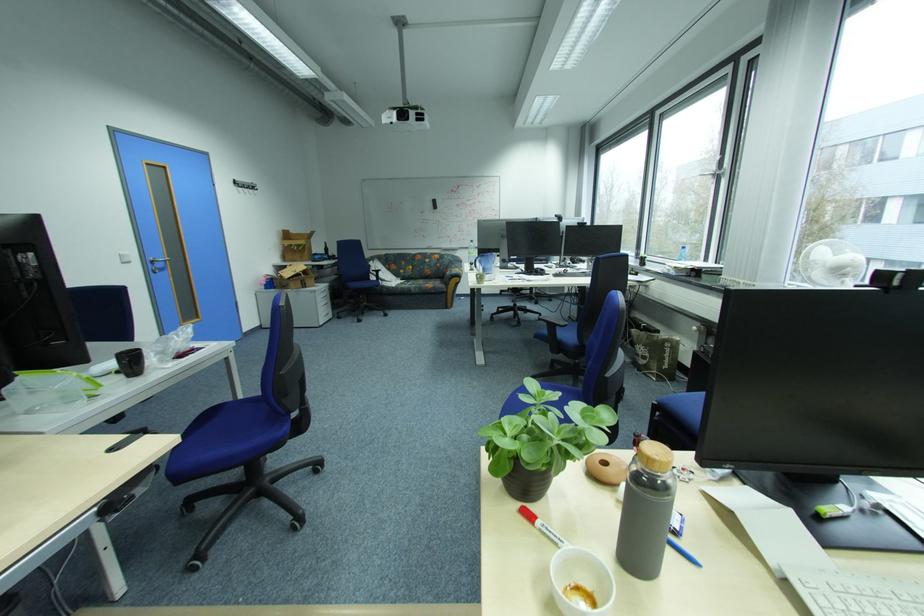
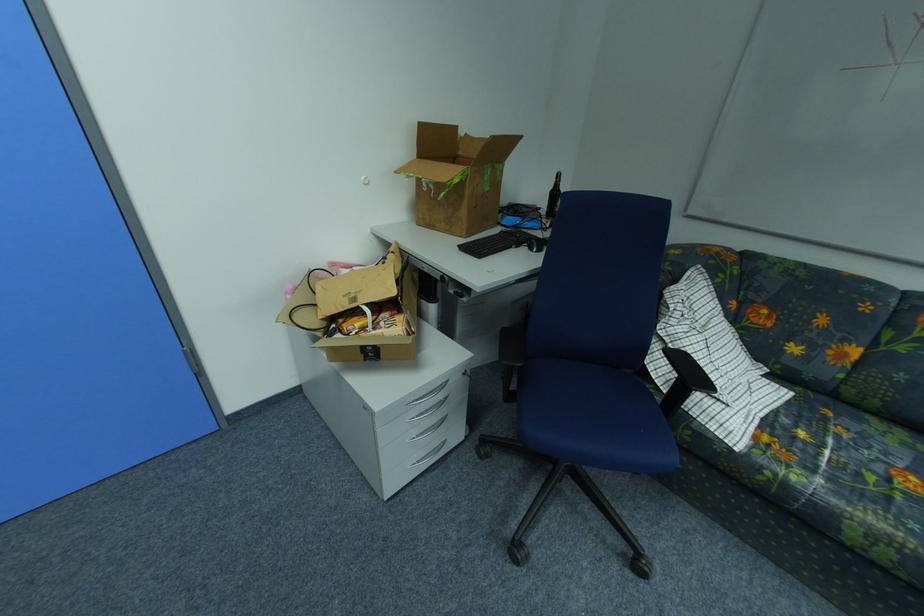
Where in the second image is the point corresponding to point (411, 286) from the first image?

(804, 479)